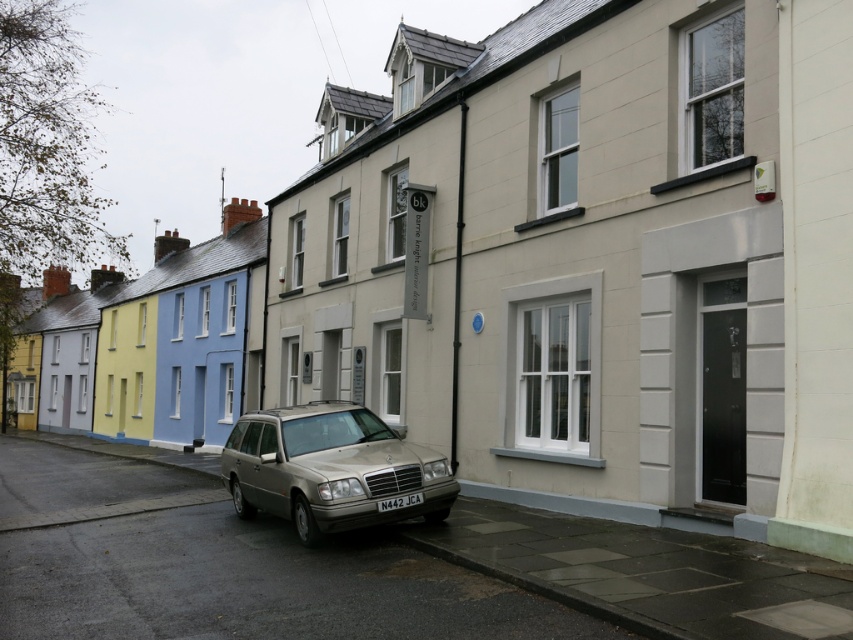
You are a delivery person trying to park your van in the space between the metallic silver station wagon at center and the white plastic license plate at center. Can your van, which is 10 feet long, fit in that space?

The space between the metallic silver station wagon at center and the white plastic license plate at center is only 4.39 feet, which is much shorter than your 10 feet long van. Therefore, your van cannot fit in that space.

You are a delivery person trying to park a car that is 1.8 meters wide in the space between the metallic silver station wagon at center and the white plastic license plate at center. Can your car fit in that space?

The metallic silver station wagon at center is wider than the white plastic license plate at center. Since the space between them is narrower than the car, your car cannot fit in that space.

You are a delivery driver who needs to deliver a package to the house behind the metallic silver station wagon at center. Can you see the white plastic license plate at center from your current position?

The metallic silver station wagon at center is located above the white plastic license plate at center, so yes, you can see the white plastic license plate at center from your current position because it is positioned below the car.